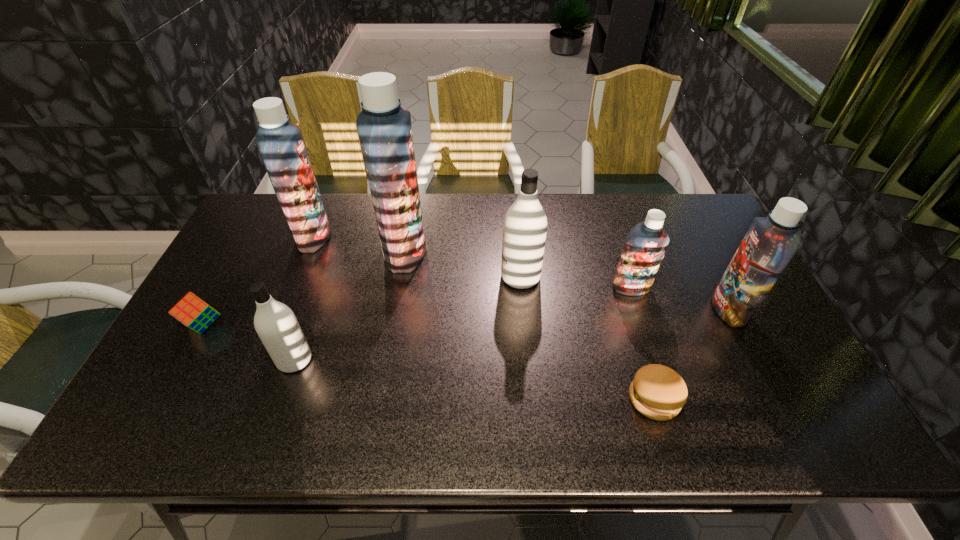
Find the location of `free space located on the front label of the rightmost object`. free space located on the front label of the rightmost object is located at coordinates (602, 309).

Identify the location of free space located on the front-facing side of the right white shampoo. (446, 277).

I want to click on vacant space located 0.210m on the front-facing side of the right white shampoo, so click(x=430, y=277).

This screenshot has width=960, height=540. I want to click on vacant space situated on the front-facing side of the right white shampoo, so click(x=406, y=277).

Identify the location of free space located 0.050m on the front-facing side of the smaller white shampoo. The height and width of the screenshot is (540, 960). (332, 360).

Identify the location of free spot located 0.190m on the front label of the fifth shampoo from left to right. The width and height of the screenshot is (960, 540). [652, 353].

The image size is (960, 540). Find the location of `blank area located 0.150m on the front of the leftmost object`. blank area located 0.150m on the front of the leftmost object is located at coordinates point(165,393).

Where is `vacant space situated 0.320m on the right of the shortest object`? The image size is (960, 540). vacant space situated 0.320m on the right of the shortest object is located at coordinates (816, 399).

Identify the location of object positioned at the near edge. (658, 392).

Locate an element on the screen. This screenshot has width=960, height=540. object present at the left edge is located at coordinates click(x=193, y=312).